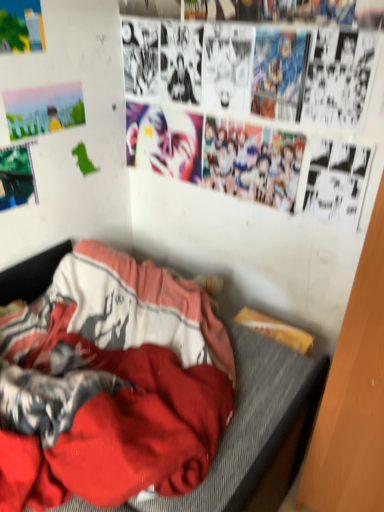
Question: Does red fabric bed at lower left have a smaller size compared to matte paper poster at upper left, acting as the 1th poster page starting from the top?

Choices:
 (A) yes
 (B) no

Answer: (B)

Question: Are red fabric bed at lower left and matte paper poster at upper left, the third poster page ordered from the bottom, located far from each other?

Choices:
 (A) yes
 (B) no

Answer: (A)

Question: Is red fabric bed at lower left taller than matte paper poster at upper left, acting as the 1th poster page starting from the top?

Choices:
 (A) yes
 (B) no

Answer: (A)

Question: Is red fabric bed at lower left positioned before matte paper poster at upper left, the third poster page ordered from the bottom?

Choices:
 (A) no
 (B) yes

Answer: (B)

Question: From the image's perspective, is red fabric bed at lower left on matte paper poster at upper left, acting as the 1th poster page starting from the top?

Choices:
 (A) no
 (B) yes

Answer: (A)

Question: Is red fabric bed at lower left bigger than matte paper poster at upper left, the third poster page ordered from the bottom?

Choices:
 (A) no
 (B) yes

Answer: (B)

Question: Is matte paper poster at upper left, the third poster page ordered from the bottom, bigger than shiny metallic mask at upper center?

Choices:
 (A) no
 (B) yes

Answer: (A)

Question: Is matte paper poster at upper left, the third poster page ordered from the bottom, to the right of shiny metallic mask at upper center from the viewer's perspective?

Choices:
 (A) yes
 (B) no

Answer: (B)

Question: Could you tell me if matte paper poster at upper left, the third poster page ordered from the bottom, is turned towards shiny metallic mask at upper center?

Choices:
 (A) yes
 (B) no

Answer: (B)

Question: Considering the relative sizes of matte paper poster at upper left, acting as the 1th poster page starting from the top, and shiny metallic mask at upper center in the image provided, is matte paper poster at upper left, acting as the 1th poster page starting from the top, wider than shiny metallic mask at upper center?

Choices:
 (A) yes
 (B) no

Answer: (B)

Question: Would you say matte paper poster at upper left, the third poster page ordered from the bottom, contains shiny metallic mask at upper center?

Choices:
 (A) no
 (B) yes

Answer: (A)

Question: Is matte paper poster at upper left, the third poster page ordered from the bottom, taller than shiny metallic mask at upper center?

Choices:
 (A) yes
 (B) no

Answer: (B)

Question: Can you confirm if matte paper poster at upper left, acting as the 1th poster page starting from the top, is shorter than metallic green poster at upper left, the 3th poster page when ordered from top to bottom?

Choices:
 (A) yes
 (B) no

Answer: (A)